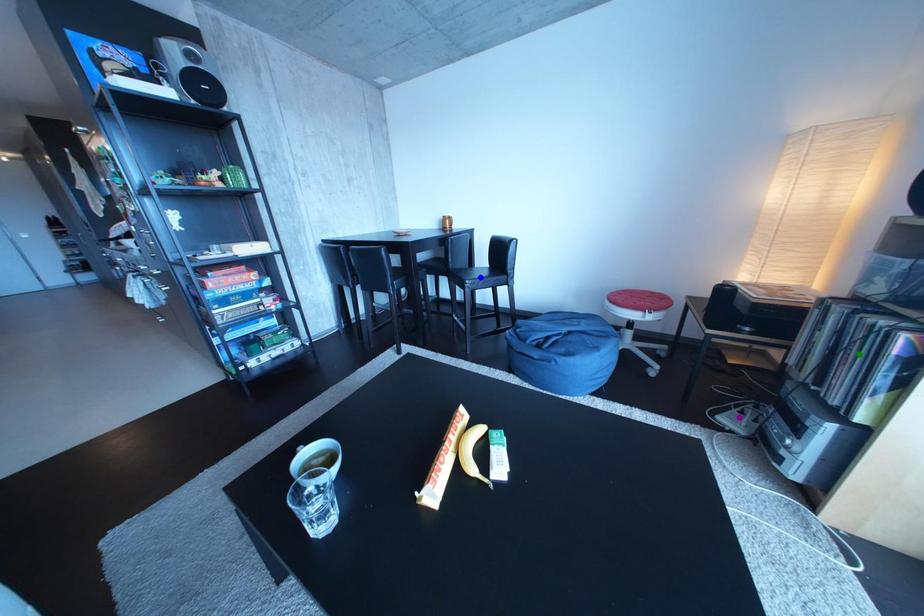
Order these from nearest to farthest:
purple point | blue point | green point

blue point < purple point < green point